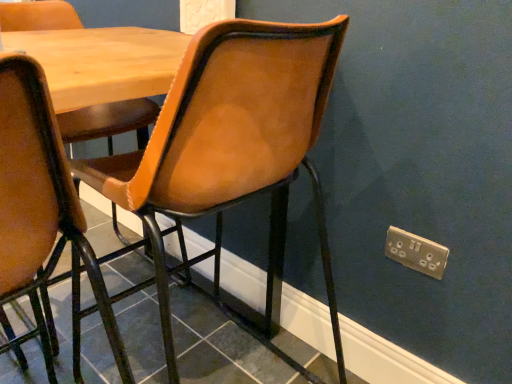
You are a GUI agent. You are given a task and a screenshot of the screen. Output one action in this format:
    pyautogui.click(x=<x>, y=<y>)
    Task: Click on the matte black tile at lower center
    
    Given the screenshot: What is the action you would take?
    pyautogui.click(x=220, y=347)

The width and height of the screenshot is (512, 384). Describe the element at coordinates (230, 154) in the screenshot. I see `leather-like brown chair at center` at that location.

Image resolution: width=512 pixels, height=384 pixels. What do you see at coordinates (416, 252) in the screenshot? I see `gold metallic electric outlet at lower right` at bounding box center [416, 252].

Locate an element on the screen. wooden table at center is located at coordinates (103, 62).

Is wooden table at center facing towards gold metallic electric outlet at lower right?

No.

In the scene shown: Is wooden table at center beside gold metallic electric outlet at lower right?

No, wooden table at center is not making contact with gold metallic electric outlet at lower right.

From the image's perspective, is wooden table at center beneath gold metallic electric outlet at lower right?

Correct, wooden table at center appears lower than gold metallic electric outlet at lower right in the image.

Considering the sizes of objects wooden table at center and gold metallic electric outlet at lower right in the image provided, who is shorter, wooden table at center or gold metallic electric outlet at lower right?

Standing shorter between the two is gold metallic electric outlet at lower right.

Would you say wooden table at center is to the left or to the right of leather-like brown chair at center in the picture?

wooden table at center is positioned on leather-like brown chair at center's right side.

In the scene shown: Is wooden table at center facing away from leather-like brown chair at center?

That's right, wooden table at center is facing away from leather-like brown chair at center.

Considering the relative sizes of wooden table at center and leather-like brown chair at center in the image provided, is wooden table at center thinner than leather-like brown chair at center?

Indeed, wooden table at center has a lesser width compared to leather-like brown chair at center.

Which is behind, point (151, 66) or point (217, 212)?

The point (217, 212) is farther.

From the image's perspective, is matte black tile at lower center below leather-like brown chair at center?

Correct, matte black tile at lower center appears lower than leather-like brown chair at center in the image.

What's the angular difference between matte black tile at lower center and leather-like brown chair at center's facing directions?

90.2 degrees separate the facing orientations of matte black tile at lower center and leather-like brown chair at center.

Would you say matte black tile at lower center is outside leather-like brown chair at center?

Yes.

Relative to leather-like brown chair at center, is matte black tile at lower center in front or behind?

In the image, matte black tile at lower center appears behind leather-like brown chair at center.

Between leather-like brown chair at center and gold metallic electric outlet at lower right, which one has less height?

Standing shorter between the two is gold metallic electric outlet at lower right.

Which is in front, point (197, 112) or point (439, 248)?

Positioned in front is point (197, 112).

Is leather-like brown chair at center positioned in front of gold metallic electric outlet at lower right?

That is True.

Between leather-like brown chair at center and gold metallic electric outlet at lower right, which one has smaller width?

gold metallic electric outlet at lower right is thinner.

Is gold metallic electric outlet at lower right further to the viewer compared to leather-like brown chair at center?

That is True.

Who is taller, gold metallic electric outlet at lower right or leather-like brown chair at center?

Standing taller between the two is leather-like brown chair at center.

Would you say gold metallic electric outlet at lower right is a long distance from leather-like brown chair at center?

No, there isn't a large distance between gold metallic electric outlet at lower right and leather-like brown chair at center.

Does gold metallic electric outlet at lower right have a greater width compared to leather-like brown chair at center?

Incorrect, the width of gold metallic electric outlet at lower right does not surpass that of leather-like brown chair at center.

Is matte black tile at lower center behind gold metallic electric outlet at lower right?

That is False.

How far apart are matte black tile at lower center and gold metallic electric outlet at lower right?

They are 80.96 centimeters apart.

Considering the points (68, 265) and (435, 272), which point is behind, point (68, 265) or point (435, 272)?

Point (68, 265)

Is matte black tile at lower center at the left side of gold metallic electric outlet at lower right?

Indeed, matte black tile at lower center is positioned on the left side of gold metallic electric outlet at lower right.

Is leather-like brown chair at center inside or outside of matte black tile at lower center?

leather-like brown chair at center is not enclosed by matte black tile at lower center.

Does leather-like brown chair at center have a greater width compared to matte black tile at lower center?

No.

Does leather-like brown chair at center touch matte black tile at lower center?

They are not placed beside each other.

Identify the location of electric outlet above the wooden table at center (from the image's perspective). 416,252.

This screenshot has width=512, height=384. Find the location of `table above the leather-like brown chair at center (from a real-world perspective)`. table above the leather-like brown chair at center (from a real-world perspective) is located at coordinates (103, 62).

Estimate the real-world distances between objects in this image. Which object is further from wooden table at center, leather-like brown chair at center or gold metallic electric outlet at lower right?

gold metallic electric outlet at lower right lies further to wooden table at center than the other object.

Estimate the real-world distances between objects in this image. Which object is further from matte black tile at lower center, wooden table at center or leather-like brown chair at center?

wooden table at center is positioned further to the anchor matte black tile at lower center.

Which object lies nearer to the anchor point gold metallic electric outlet at lower right, matte black tile at lower center or leather-like brown chair at center?

leather-like brown chair at center is closer to gold metallic electric outlet at lower right.

When comparing their distances from gold metallic electric outlet at lower right, does leather-like brown chair at center or wooden table at center seem closer?

Based on the image, leather-like brown chair at center appears to be nearer to gold metallic electric outlet at lower right.

Looking at the image, which one is located closer to leather-like brown chair at center, gold metallic electric outlet at lower right or wooden table at center?

wooden table at center lies closer to leather-like brown chair at center than the other object.

Looking at the image, which one is located closer to leather-like brown chair at center, gold metallic electric outlet at lower right or matte black tile at lower center?

matte black tile at lower center is closer to leather-like brown chair at center.

When comparing their distances from wooden table at center, does leather-like brown chair at center or matte black tile at lower center seem further?

Among the two, matte black tile at lower center is located further to wooden table at center.

Which object lies further to the anchor point gold metallic electric outlet at lower right, wooden table at center or matte black tile at lower center?

matte black tile at lower center is positioned further to the anchor gold metallic electric outlet at lower right.

Identify the location of table situated between leather-like brown chair at center and gold metallic electric outlet at lower right from left to right. (103, 62).

This screenshot has height=384, width=512. In order to click on tile situated between wooden table at center and gold metallic electric outlet at lower right from left to right in this screenshot , I will do `click(220, 347)`.

This screenshot has height=384, width=512. In order to click on tile between leather-like brown chair at center and gold metallic electric outlet at lower right in the horizontal direction in this screenshot , I will do `click(220, 347)`.

This screenshot has height=384, width=512. Find the location of `table that lies between leather-like brown chair at center and matte black tile at lower center from top to bottom`. table that lies between leather-like brown chair at center and matte black tile at lower center from top to bottom is located at coordinates (103, 62).